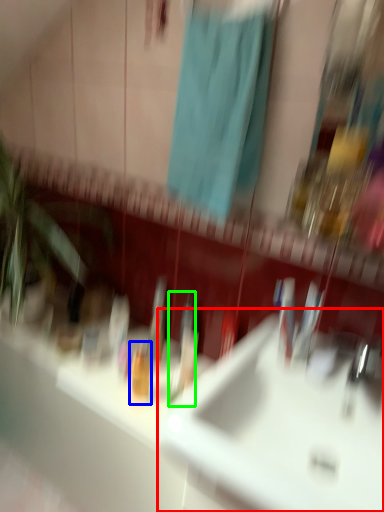
Question: Which is farther away from sink (highlighted by a red box)? toiletry (highlighted by a blue box) or toothbrush (highlighted by a green box)?

Choices:
 (A) toiletry
 (B) toothbrush

Answer: (A)